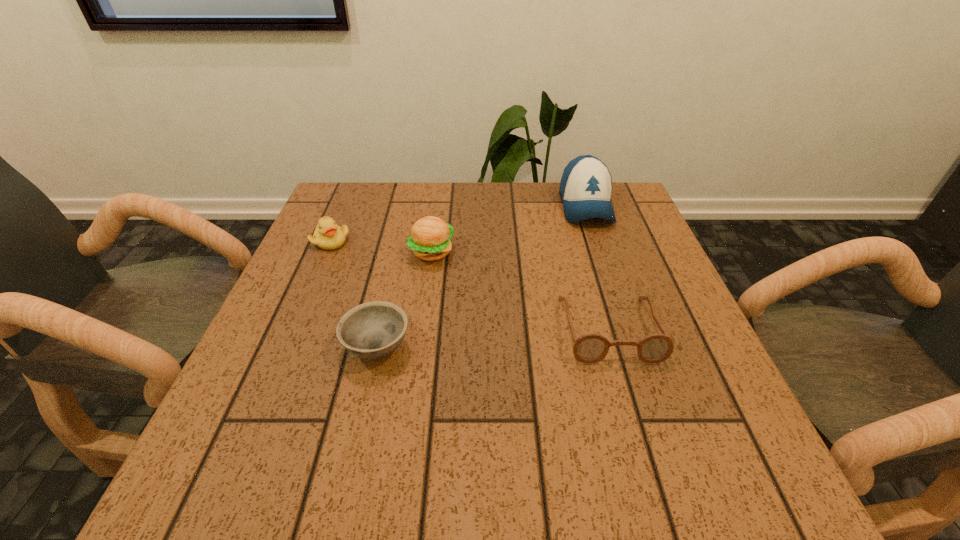
This screenshot has height=540, width=960. Identify the location of the tallest object. (585, 188).

The height and width of the screenshot is (540, 960). Find the location of `the farthest object`. the farthest object is located at coordinates (585, 188).

You are a GUI agent. You are given a task and a screenshot of the screen. Output one action in this format:
    pyautogui.click(x=<x>, y=<y>)
    Task: Click on the fourth shortest object
    The image size is (960, 540).
    Given the screenshot: What is the action you would take?
    pyautogui.click(x=430, y=239)

Identify the location of the leftmost object. (328, 236).

Locate an element on the screen. spectacles is located at coordinates (591, 348).

Locate an element on the screen. Image resolution: width=960 pixels, height=540 pixels. bowl is located at coordinates (372, 330).

You are a GUI agent. You are given a task and a screenshot of the screen. Output one action in this format:
    pyautogui.click(x=<x>, y=<y>)
    Task: Click on the free region located on the front-facing side of the farthest object
    The image size is (960, 540).
    Given the screenshot: What is the action you would take?
    pyautogui.click(x=598, y=242)

Find the location of a particular element. This screenshot has height=540, width=960. vacant space located 0.350m on the front of the hamburger is located at coordinates (412, 404).

Locate an element on the screen. The height and width of the screenshot is (540, 960). vacant space located on the front-facing side of the leftmost object is located at coordinates (299, 315).

Locate an element on the screen. The width and height of the screenshot is (960, 540). free space located on the front-facing side of the spectacles is located at coordinates (632, 404).